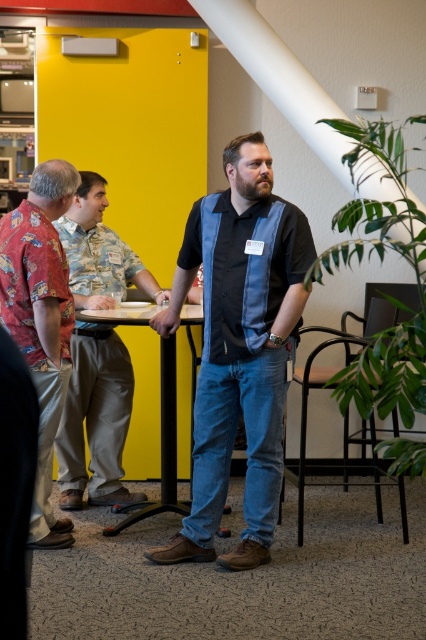
Question: Is matte khaki pants at left positioned in front of printed fabric shirt at left?

Choices:
 (A) yes
 (B) no

Answer: (B)

Question: Which of these objects is positioned closest to the black plastic table at center?

Choices:
 (A) printed fabric shirt at left
 (B) matte khaki pants at left

Answer: (B)

Question: Does denim jeans at center have a smaller size compared to printed fabric shirt at left?

Choices:
 (A) no
 (B) yes

Answer: (A)

Question: Among these points, which one is nearest to the camera?

Choices:
 (A) (172, 538)
 (B) (74, 243)
 (C) (23, 291)

Answer: (C)

Question: Which point is closer to the camera?

Choices:
 (A) (169, 371)
 (B) (115, 496)

Answer: (A)

Question: Does denim jeans at center lie in front of matte khaki pants at left?

Choices:
 (A) yes
 (B) no

Answer: (A)